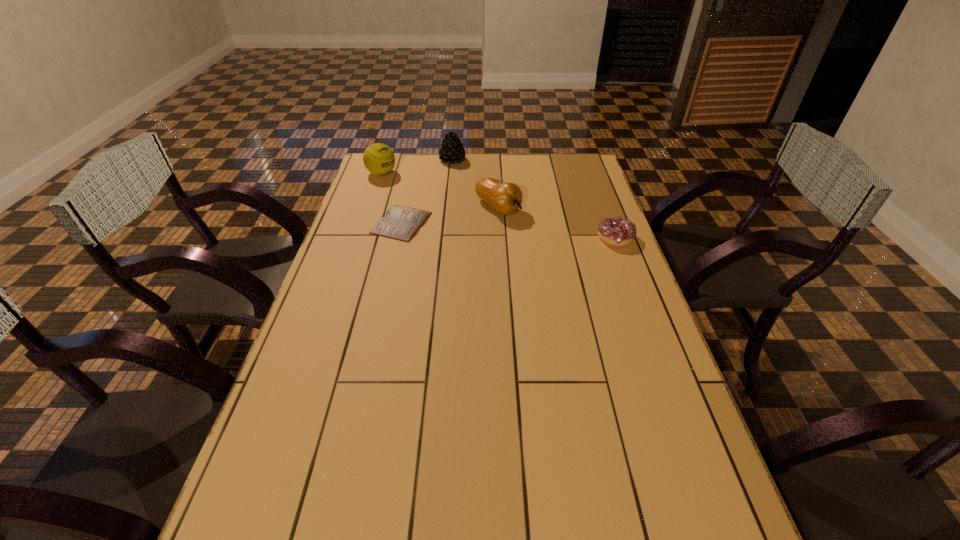
Locate an element on the screen. The image size is (960, 540). vacant space on the desktop that is between the diary and the doughnut and is positioned at the narrow end of the pinecone is located at coordinates (531, 232).

This screenshot has height=540, width=960. I want to click on free space on the desktop that is between the diary and the doughnut and is positioned on the stem side of the fourth object from left to right, so click(538, 232).

Image resolution: width=960 pixels, height=540 pixels. I want to click on free spot on the desktop that is between the shortest object and the second shortest object and is positioned on the logo side of the softball, so click(x=501, y=230).